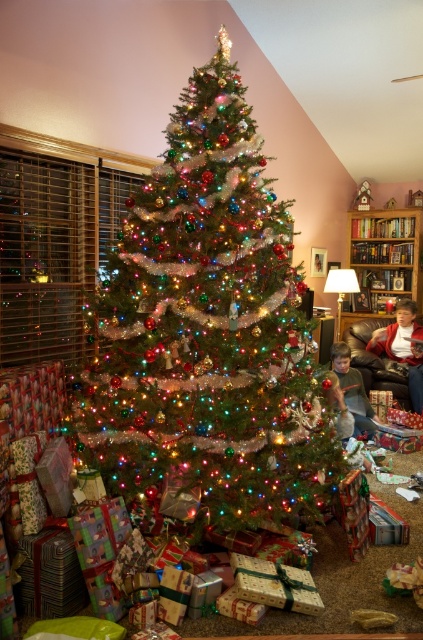
Is matte red sweater at lower right wider than green fabric shirt at lower center?

Indeed, matte red sweater at lower right has a greater width compared to green fabric shirt at lower center.

Is matte red sweater at lower right smaller than green fabric shirt at lower center?

Actually, matte red sweater at lower right might be larger than green fabric shirt at lower center.

You are a GUI agent. You are given a task and a screenshot of the screen. Output one action in this format:
    pyautogui.click(x=<x>, y=<y>)
    Task: Click on the matte red sweater at lower right
    The width and height of the screenshot is (423, 640).
    Given the screenshot: What is the action you would take?
    [403, 346]

Can you confirm if shiny green christmas tree at center is bigger than wooden bookshelf at right?

Yes, shiny green christmas tree at center is bigger than wooden bookshelf at right.

Describe the element at coordinates (209, 339) in the screenshot. This screenshot has width=423, height=640. I see `shiny green christmas tree at center` at that location.

Where is `shiny green christmas tree at center`? The image size is (423, 640). shiny green christmas tree at center is located at coordinates (209, 339).

At what (x,y) coordinates should I click in order to perform the action: click on shiny green christmas tree at center. Please return your answer as a coordinate pair (x, y). The image size is (423, 640). Looking at the image, I should click on (209, 339).

Is point (409, 282) positioned behind point (397, 321)?

Yes.

Who is higher up, wooden bookshelf at right or matte red sweater at lower right?

wooden bookshelf at right is above.

The width and height of the screenshot is (423, 640). What do you see at coordinates (384, 259) in the screenshot?
I see `wooden bookshelf at right` at bounding box center [384, 259].

What are the coordinates of `wooden bookshelf at right` in the screenshot? It's located at (384, 259).